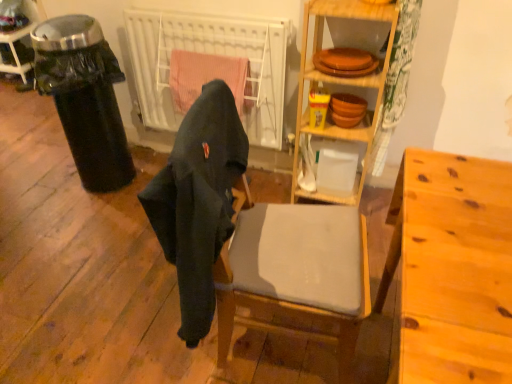
What is the approximate width of matte gray cushioned chair at center?

matte gray cushioned chair at center is 19.67 inches wide.

Image resolution: width=512 pixels, height=384 pixels. I want to click on wooden shelves at center, so click(341, 86).

What do you see at coordinates (214, 54) in the screenshot? I see `white matte radiator at center` at bounding box center [214, 54].

This screenshot has height=384, width=512. Describe the element at coordinates (84, 97) in the screenshot. I see `black plastic trash can at left` at that location.

What do you see at coordinates (18, 38) in the screenshot? The width and height of the screenshot is (512, 384). I see `metallic trash can at left` at bounding box center [18, 38].

This screenshot has width=512, height=384. Describe the element at coordinates (198, 201) in the screenshot. I see `dark gray fabric chair at center` at that location.

This screenshot has width=512, height=384. Identify the location of matte gray cushioned chair at center. (250, 238).

From the image's perspective, is matte gray cushioned chair at center located above black plastic trash can at left?

No, from the image's perspective, matte gray cushioned chair at center is not above black plastic trash can at left.

From a real-world perspective, is matte gray cushioned chair at center positioned over black plastic trash can at left based on gravity?

Yes, from a real-world perspective, matte gray cushioned chair at center is above black plastic trash can at left.

Could you tell me if matte gray cushioned chair at center is turned towards black plastic trash can at left?

No, matte gray cushioned chair at center is not facing towards black plastic trash can at left.

Which point is more forward, (202, 238) or (63, 30)?

The point (202, 238) is more forward.

Considering the relative sizes of metallic trash can at left and dark gray fabric chair at center in the image provided, is metallic trash can at left bigger than dark gray fabric chair at center?

Incorrect, metallic trash can at left is not larger than dark gray fabric chair at center.

Is point (28, 14) farther from camera compared to point (200, 192)?

Yes, point (28, 14) is farther from viewer.

Could dark gray fabric chair at center be considered to be inside metallic trash can at left?

Definitely not — dark gray fabric chair at center is not inside metallic trash can at left.

Is matte gray cushioned chair at center completely or partially outside of dark gray fabric chair at center?

Absolutely, matte gray cushioned chair at center is external to dark gray fabric chair at center.

Which object is thinner, matte gray cushioned chair at center or dark gray fabric chair at center?

Thinner between the two is dark gray fabric chair at center.

Find the location of a particular element. The image size is (512, 384). chair above the matte gray cushioned chair at center (from a real-world perspective) is located at coordinates (198, 201).

Would you say light brown wood desk at right is to the left or to the right of black plastic trash can at left in the picture?

Clearly, light brown wood desk at right is on the right of black plastic trash can at left in the image.

From the picture: Considering the relative sizes of light brown wood desk at right and black plastic trash can at left in the image provided, is light brown wood desk at right taller than black plastic trash can at left?

Incorrect, the height of light brown wood desk at right is not larger of that of black plastic trash can at left.

Which point is more distant from viewer, (499, 185) or (74, 34)?

The point (74, 34) is more distant.

Who is more distant, matte gray cushioned chair at center or light brown wood desk at right?

matte gray cushioned chair at center is more distant.

Find the location of a particular element. This screenshot has width=512, height=384. desk on the right of matte gray cushioned chair at center is located at coordinates (452, 269).

Does point (294, 234) come in front of point (496, 294)?

That is False.

You are a GUI agent. You are given a task and a screenshot of the screen. Output one action in this format:
    pyautogui.click(x=<x>, y=<y>)
    Task: Click on the desk lying on the right of wooden shelves at center
    This screenshot has width=512, height=384.
    Given the screenshot: What is the action you would take?
    pyautogui.click(x=452, y=269)

Does light brown wood desk at right have a smaller size compared to wooden shelves at center?

No, light brown wood desk at right is not smaller than wooden shelves at center.

Consider the image. From the image's perspective, is light brown wood desk at right below wooden shelves at center?

Yes, from the image's perspective, light brown wood desk at right is below wooden shelves at center.

Is light brown wood desk at right shorter than wooden shelves at center?

Yes.

Does point (342, 202) come farther from viewer compared to point (10, 34)?

No, (342, 202) is in front of (10, 34).

Is wooden shelves at center smaller than metallic trash can at left?

No, wooden shelves at center is not smaller than metallic trash can at left.

Considering the sizes of objects wooden shelves at center and metallic trash can at left in the image provided, who is wider, wooden shelves at center or metallic trash can at left?

With larger width is metallic trash can at left.

The image size is (512, 384). In order to click on shelf on the right of metallic trash can at left in this screenshot , I will do `click(341, 86)`.

Find the location of a particular element. The width and height of the screenshot is (512, 384). garbage above the matte gray cushioned chair at center (from the image's perspective) is located at coordinates [84, 97].

Locate an element on the screen. The width and height of the screenshot is (512, 384). chair on the right of metallic trash can at left is located at coordinates (198, 201).

From the image, which object appears to be farther from black plastic trash can at left, metallic trash can at left or matte gray cushioned chair at center?

The object further to black plastic trash can at left is metallic trash can at left.

In the scene shown: Considering their positions, is light brown wood desk at right positioned further to wooden shelves at center than metallic trash can at left?

metallic trash can at left is positioned further to the anchor wooden shelves at center.

From the image, which object appears to be farther from metallic trash can at left, matte gray cushioned chair at center or black plastic trash can at left?

Based on the image, matte gray cushioned chair at center appears to be further to metallic trash can at left.

Estimate the real-world distances between objects in this image. Which object is further from light brown wood desk at right, dark gray fabric chair at center or white matte radiator at center?

Among the two, white matte radiator at center is located further to light brown wood desk at right.

Based on their spatial positions, is light brown wood desk at right or metallic trash can at left further from matte gray cushioned chair at center?

Among the two, metallic trash can at left is located further to matte gray cushioned chair at center.

Looking at the image, which one is located closer to white matte radiator at center, light brown wood desk at right or dark gray fabric chair at center?

Among the two, dark gray fabric chair at center is located nearer to white matte radiator at center.

Based on the photo, based on their spatial positions, is black plastic trash can at left or white matte radiator at center closer to matte gray cushioned chair at center?

Based on the image, white matte radiator at center appears to be nearer to matte gray cushioned chair at center.

Which object lies further to the anchor point metallic trash can at left, black plastic trash can at left or dark gray fabric chair at center?

dark gray fabric chair at center is positioned further to the anchor metallic trash can at left.

Find the location of `rocking chair between black plastic trash can at left and wooden shelves at center from left to right`. rocking chair between black plastic trash can at left and wooden shelves at center from left to right is located at coordinates (250, 238).

What are the coordinates of `rocking chair between dark gray fabric chair at center and light brown wood desk at right in the horizontal direction` in the screenshot? It's located at (250, 238).

Find the location of `radiator between dark gray fabric chair at center and metallic trash can at left in the front-back direction`. radiator between dark gray fabric chair at center and metallic trash can at left in the front-back direction is located at coordinates (214, 54).

I want to click on radiator situated between metallic trash can at left and light brown wood desk at right from left to right, so click(214, 54).